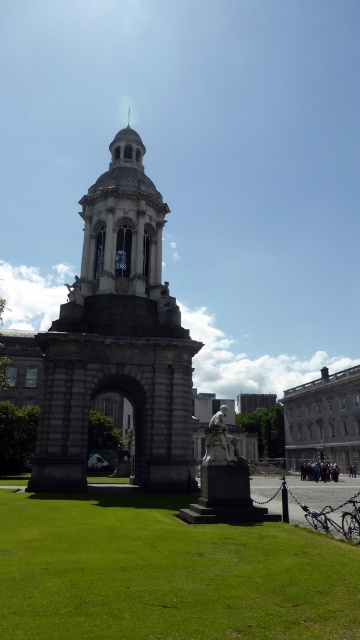
You are standing in front of the grand tower and want to determine which of the two points, point (232, 486) or point (218, 440), is closer to you. Based on the coordinates provided, which point is nearer?

Point (232, 486) is closer to the viewer than point (218, 440).

You are standing in front of the grand tower and notice the green grass at center and the white marble statue at center. Which object is closer to you?

The green grass at center is closer to the viewer than the white marble statue at center.